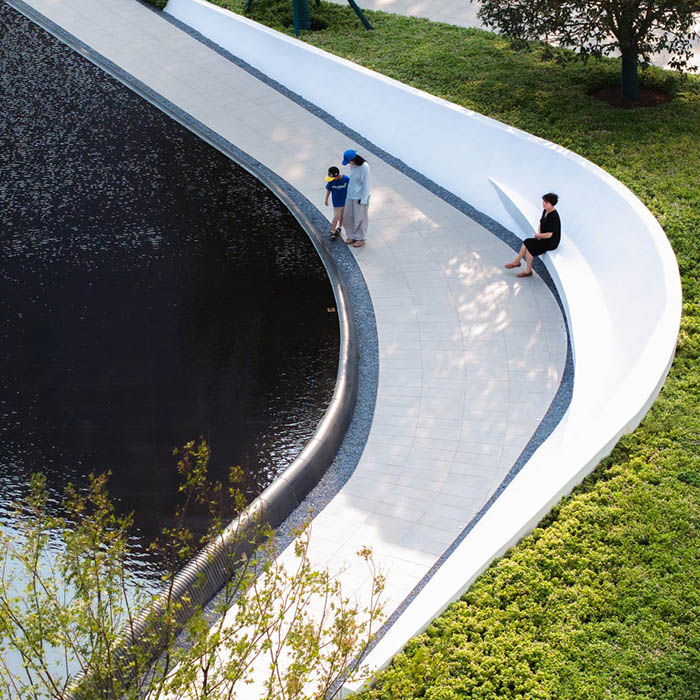
This screenshot has height=700, width=700. I want to click on place for sitting, so click(582, 315).